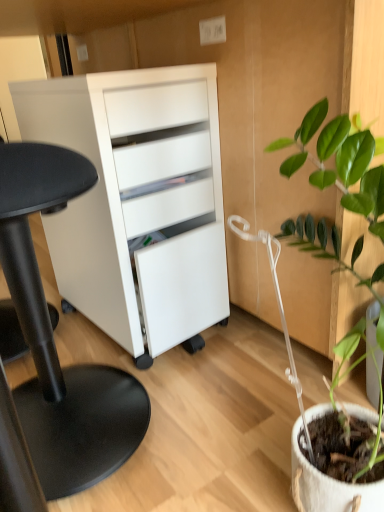
Describe the element at coordinates (340, 162) in the screenshot. The image size is (384, 512). I see `green matte plant at lower right` at that location.

Locate an element on the screen. This screenshot has height=512, width=384. green matte plant at lower right is located at coordinates (340, 162).

Where is `green matte plant at lower right`? green matte plant at lower right is located at coordinates (340, 162).